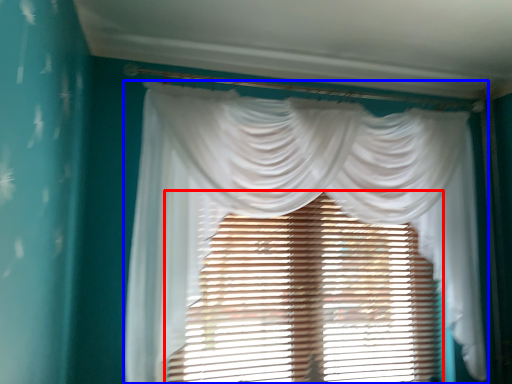
Question: Which of the following is the farthest to the observer, window blind (highlighted by a red box) or curtain (highlighted by a blue box)?

Choices:
 (A) window blind
 (B) curtain

Answer: (A)